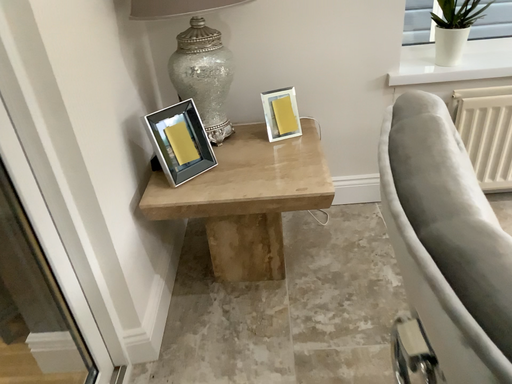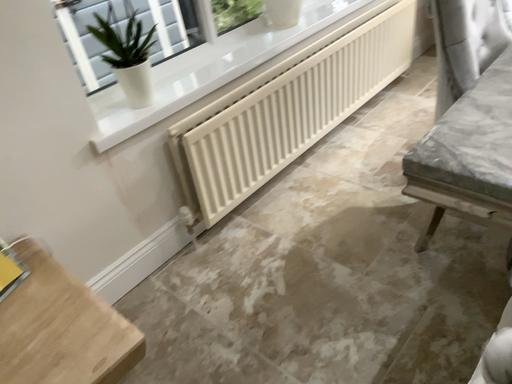
Question: Which way did the camera rotate in the video?

Choices:
 (A) rotated left
 (B) rotated right

Answer: (B)